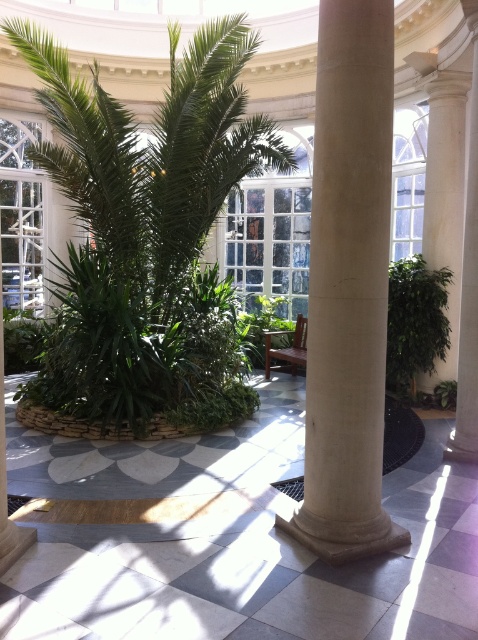
You are standing in the conservatory and want to move from the entrance to the green leafy plant at right. Which direction should you walk relative to the green leafy palm tree at center?

Since the green leafy palm tree at center is to the left of the green leafy plant at right, you should walk towards the right side of the green leafy palm tree at center to reach the green leafy plant at right.

You are standing in the conservatory and want to water the green leafy palm tree at center. If your watering can has a range of 5 meters, can you reach it without moving closer?

The green leafy palm tree at center is 5.21 meters away from the viewer. Since the watering can only reaches 5 meters, you cannot water it without moving closer.